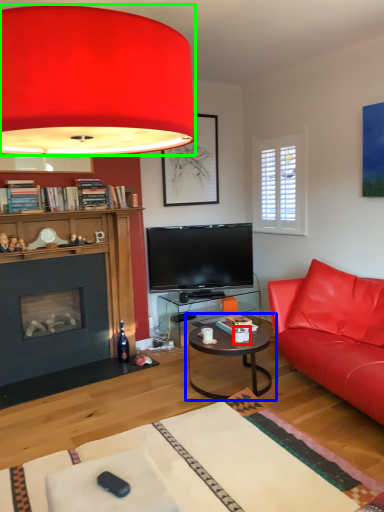
Question: Considering the real-world distances, which object is farthest from coffee cup (highlighted by a red box)? coffee table (highlighted by a blue box) or lamp (highlighted by a green box)?

Choices:
 (A) coffee table
 (B) lamp

Answer: (B)